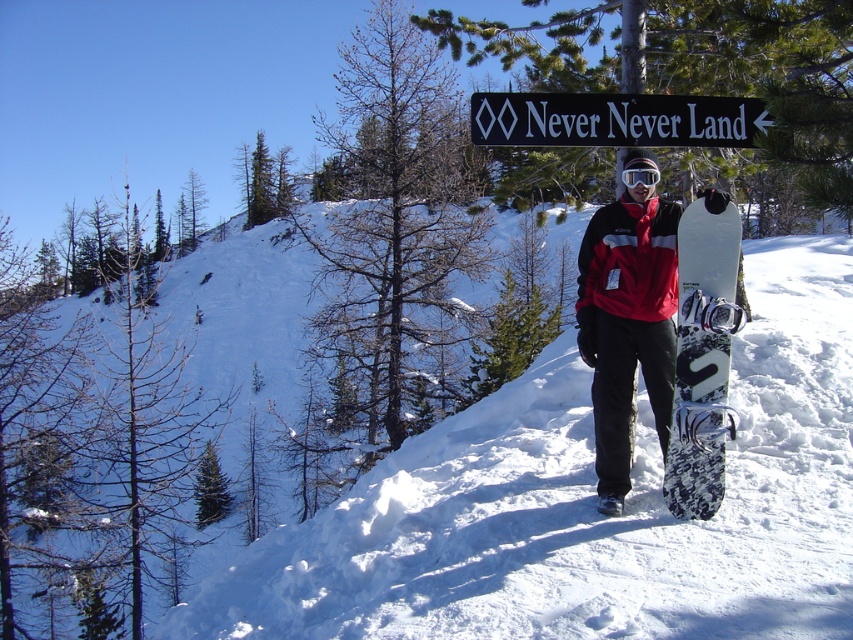
Question: Which is farther from the black plastic sign at upper center?

Choices:
 (A) white camouflage snowboard at center
 (B) glossy plastic goggles at center
 (C) white fluffy snow at center

Answer: (C)

Question: Which of these objects is positioned closest to the white camouflage snowboard at center?

Choices:
 (A) black plastic sign at upper center
 (B) glossy plastic goggles at center
 (C) white fluffy snow at center

Answer: (B)

Question: Does white camouflage snowboard at center appear on the left side of glossy plastic goggles at center?

Choices:
 (A) no
 (B) yes

Answer: (A)

Question: Which object is farther from the camera taking this photo?

Choices:
 (A) glossy plastic goggles at center
 (B) white camouflage snowboard at center
 (C) white fluffy snow at center

Answer: (A)

Question: Is black plastic sign at upper center bigger than glossy plastic goggles at center?

Choices:
 (A) yes
 (B) no

Answer: (A)

Question: Can you confirm if white fluffy snow at center is bigger than white camouflage snowboard at center?

Choices:
 (A) no
 (B) yes

Answer: (B)